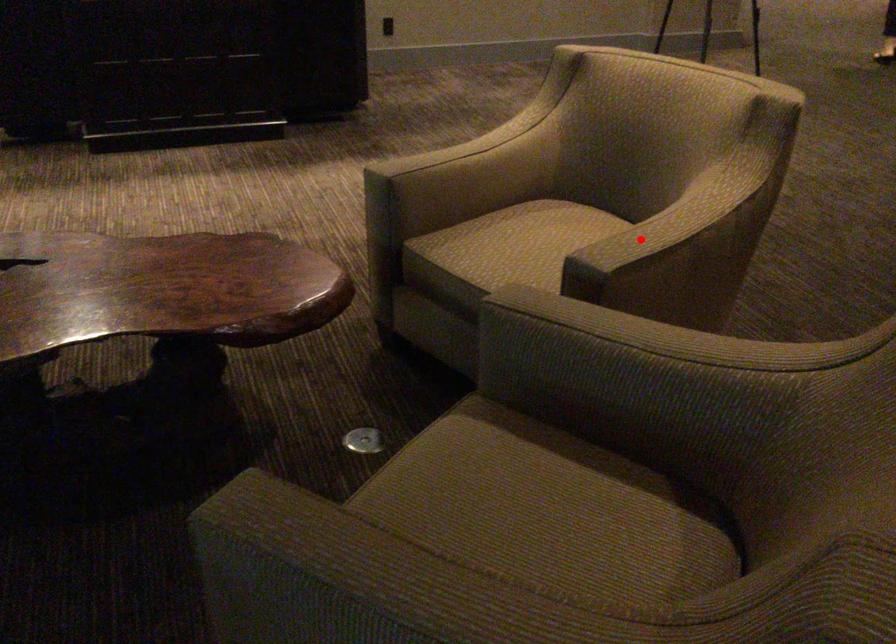
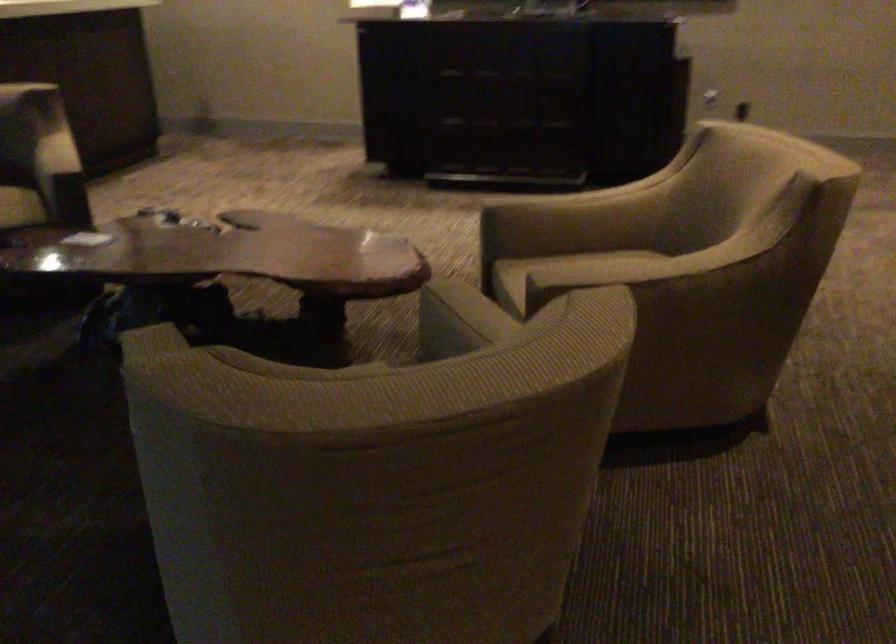
In the second image, find the point that corresponds to the highlighted location in the first image.

(599, 272)